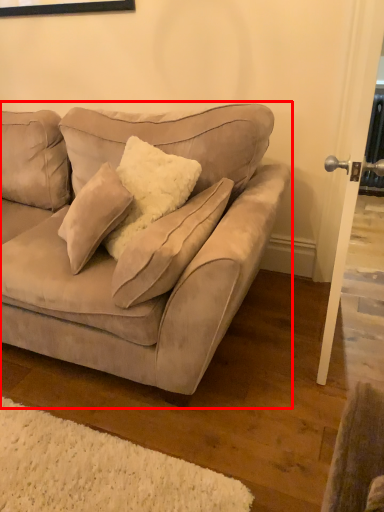
Question: From the image, what is the correct spatial relationship of studio couch (annotated by the red box) in relation to screen door?

Choices:
 (A) left
 (B) right

Answer: (A)